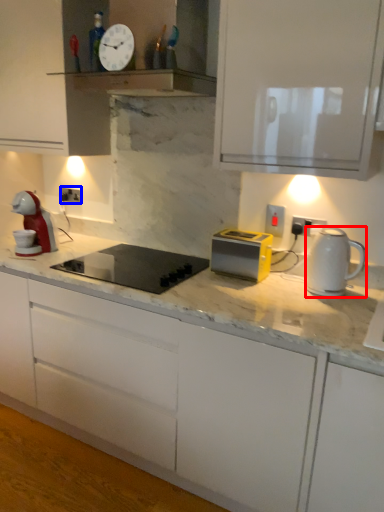
Question: Which object appears farthest to the camera in this image, kitchen appliance (highlighted by a red box) or electric outlet (highlighted by a blue box)?

Choices:
 (A) kitchen appliance
 (B) electric outlet

Answer: (B)